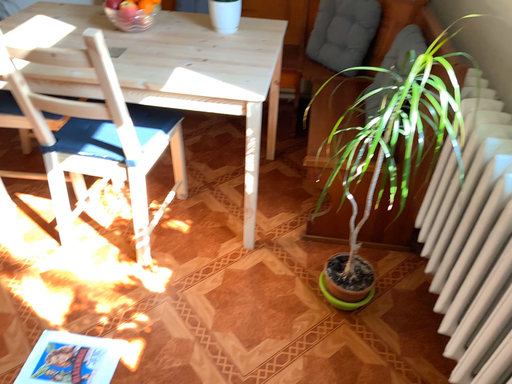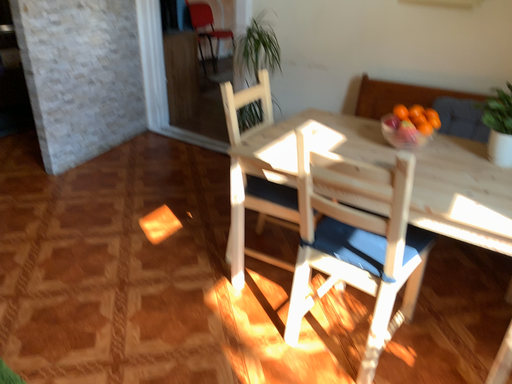
Question: Which way did the camera rotate in the video?

Choices:
 (A) rotated upward
 (B) rotated downward

Answer: (A)